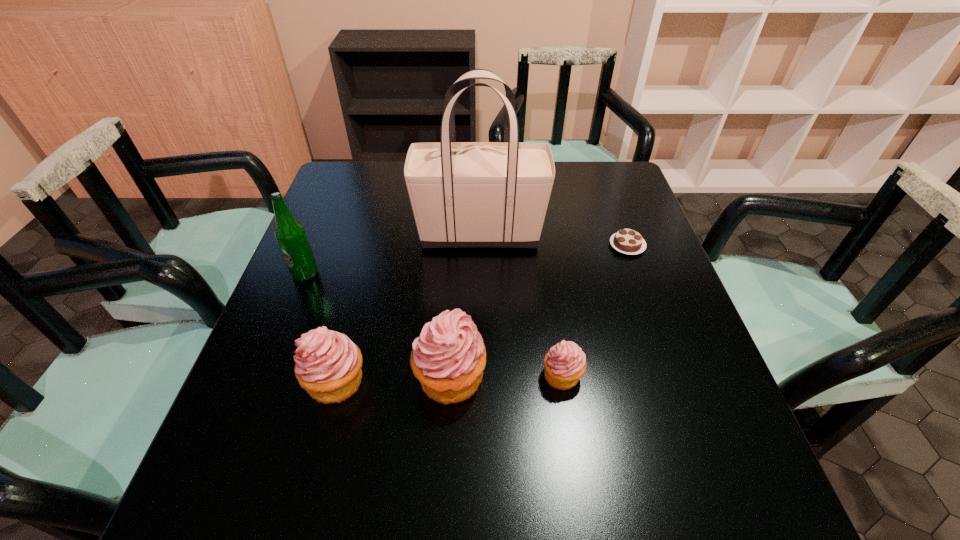
Identify the location of free area in between the tallest object and the shortest cupcake. The width and height of the screenshot is (960, 540). (521, 304).

Image resolution: width=960 pixels, height=540 pixels. Find the location of `vacant area between the second shortest object and the second cupcake from right to left`. vacant area between the second shortest object and the second cupcake from right to left is located at coordinates (506, 376).

What are the coordinates of `vacant point located between the leftmost object and the second cupcake from left to right` in the screenshot? It's located at point(377,326).

The width and height of the screenshot is (960, 540). Find the location of `free spot between the leftmost object and the second cupcake from right to left`. free spot between the leftmost object and the second cupcake from right to left is located at coordinates (377, 326).

Identify which object is the second closest to the second tallest object. Please provide its 2D coordinates. Your answer should be formatted as a tuple, i.e. [(x, y)], where the tuple contains the x and y coordinates of a point satisfying the conditions above.

[(463, 194)]

Locate which object ranks fourth in proximity to the second shortest cupcake. Please provide its 2D coordinates. Your answer should be formatted as a tuple, i.e. [(x, y)], where the tuple contains the x and y coordinates of a point satisfying the conditions above.

[(565, 363)]

Where is `cupcake object that ranks as the closest to the second cupcake from left to right`? The image size is (960, 540). cupcake object that ranks as the closest to the second cupcake from left to right is located at coordinates point(328,365).

Where is `cupcake that is the second nearest to the leftmost cupcake`? This screenshot has width=960, height=540. cupcake that is the second nearest to the leftmost cupcake is located at coordinates (565, 363).

You are a GUI agent. You are given a task and a screenshot of the screen. Output one action in this format:
    pyautogui.click(x=<x>, y=<y>)
    Task: Click on the free space that satisfies the following two spatial constraints: 1. with handles facing forward on the rightmost object; 2. on the left side of the shopping bag
    This screenshot has width=960, height=540.
    Given the screenshot: What is the action you would take?
    pyautogui.click(x=480, y=245)

Where is `free space that satisfies the following two spatial constraints: 1. on the label of the beer bottle; 2. on the left side of the rightmost cupcake`? This screenshot has width=960, height=540. free space that satisfies the following two spatial constraints: 1. on the label of the beer bottle; 2. on the left side of the rightmost cupcake is located at coordinates (265, 375).